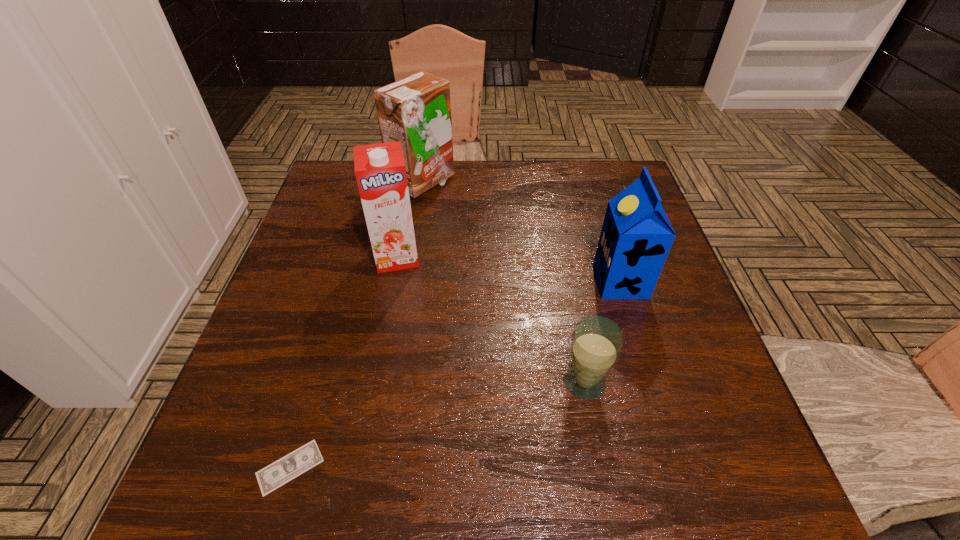
You are a GUI agent. You are given a task and a screenshot of the screen. Output one action in this format:
    pyautogui.click(x=<x>, y=<y>)
    Task: Click on the free space in the image that satisfies the following two spatial constraints: 1. on the straw side of the second object from right to left; 2. on the left side of the farthest object
    This screenshot has width=960, height=540.
    Given the screenshot: What is the action you would take?
    pyautogui.click(x=391, y=382)

Where is `free location that satisfies the following two spatial constraints: 1. with the cap open on the rightmost carton; 2. on the front side of the fourth farthest object`? This screenshot has width=960, height=540. free location that satisfies the following two spatial constraints: 1. with the cap open on the rightmost carton; 2. on the front side of the fourth farthest object is located at coordinates (651, 382).